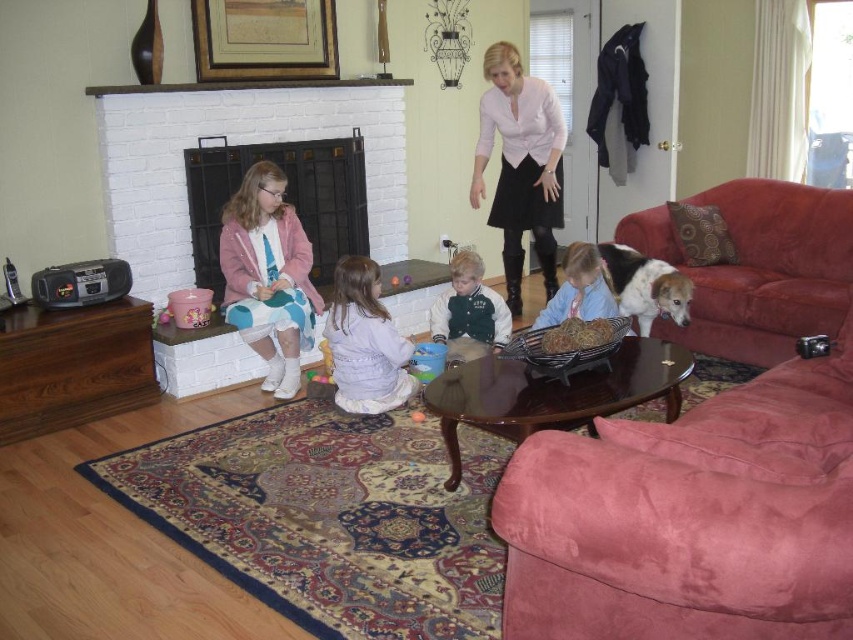
Who is positioned more to the left, suede-like pink armchair at lower right or rubber orange ball at center?

rubber orange ball at center is more to the left.

Is suede-like pink armchair at lower right to the left of rubber orange ball at center from the viewer's perspective?

No, suede-like pink armchair at lower right is not to the left of rubber orange ball at center.

Find the location of `suede-like pink armchair at lower right`. suede-like pink armchair at lower right is located at coordinates (689, 516).

Where is `suede-like pink armchair at lower right`? Image resolution: width=853 pixels, height=640 pixels. suede-like pink armchair at lower right is located at coordinates (689, 516).

Can you confirm if light purple fabric dress at center is smaller than rubber orange ball at center?

Actually, light purple fabric dress at center might be larger than rubber orange ball at center.

Does point (335, 305) come closer to viewer compared to point (410, 419)?

Yes, it is.

This screenshot has height=640, width=853. Describe the element at coordinates (364, 342) in the screenshot. I see `light purple fabric dress at center` at that location.

This screenshot has height=640, width=853. Identify the location of light purple fabric dress at center. (364, 342).

Can you confirm if velvet red couch at right is positioned to the right of green velvety jacket at center?

Indeed, velvet red couch at right is positioned on the right side of green velvety jacket at center.

Is velvet red couch at right smaller than green velvety jacket at center?

Incorrect, velvet red couch at right is not smaller in size than green velvety jacket at center.

Find the location of a particular element. The height and width of the screenshot is (640, 853). velvet red couch at right is located at coordinates (759, 268).